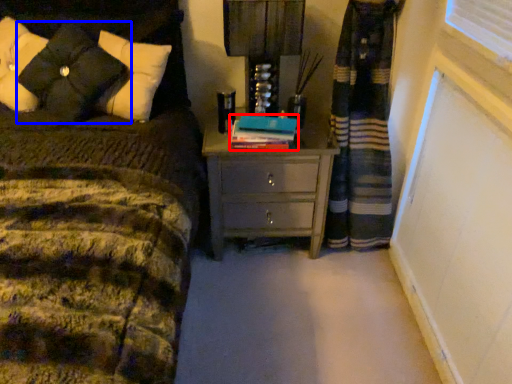
Question: Which object appears closest to the camera in this image, book (highlighted by a red box) or pillow (highlighted by a blue box)?

Choices:
 (A) book
 (B) pillow

Answer: (B)